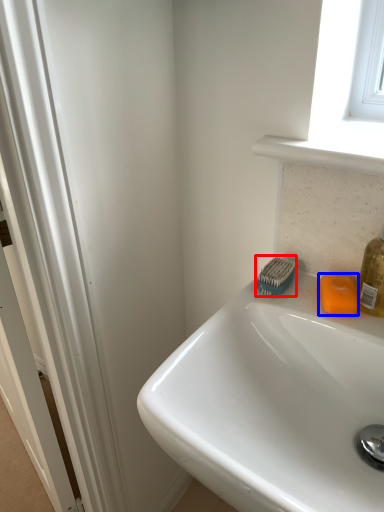
Question: Which object appears farthest to the camera in this image, brush (highlighted by a red box) or soap (highlighted by a blue box)?

Choices:
 (A) brush
 (B) soap

Answer: (A)